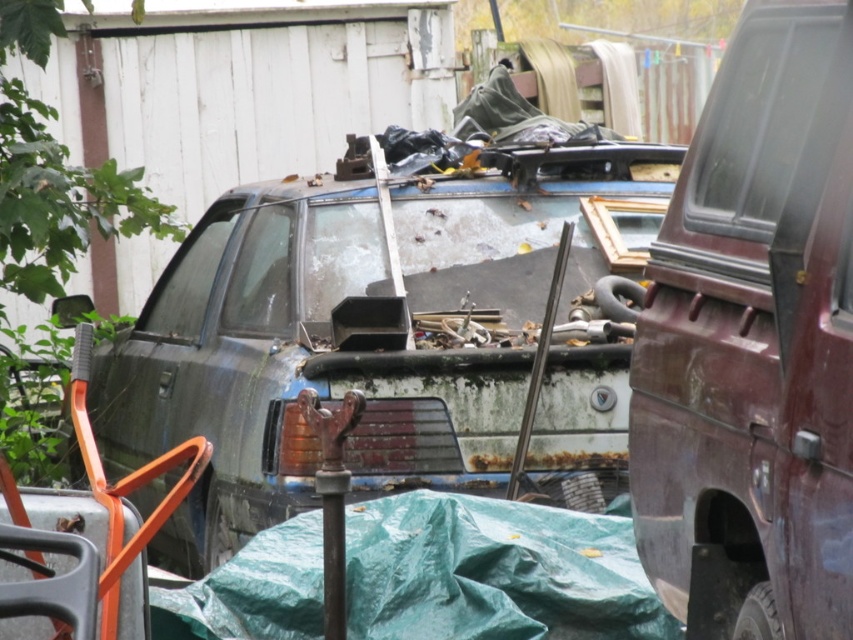
Measure the distance from rusty metal car at center to rusty metal pickup at right.

2.16 meters

Based on the photo, is rusty metal car at center below rusty metal pickup at right?

No.

The image size is (853, 640). What do you see at coordinates (363, 328) in the screenshot?
I see `rusty metal car at center` at bounding box center [363, 328].

The width and height of the screenshot is (853, 640). I want to click on rusty metal car at center, so click(x=363, y=328).